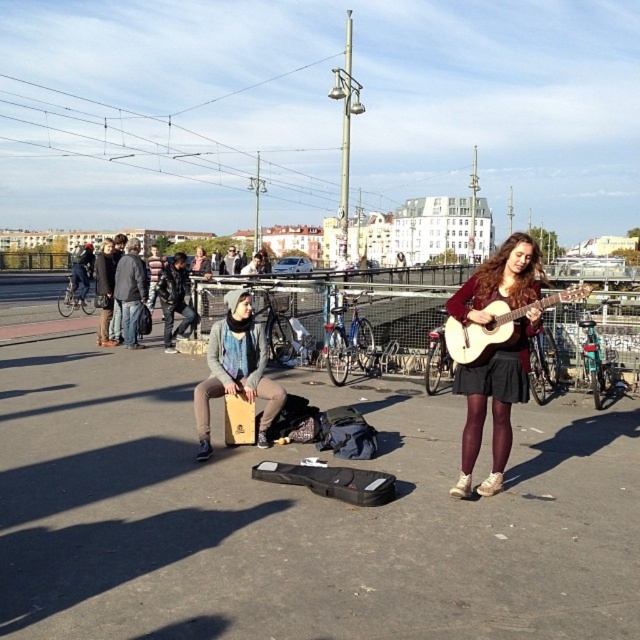
Is point (506, 244) closer to viewer compared to point (544, 298)?

No.

Which is more to the left, matte brown guitar at center or acoustic wood guitar at right?

matte brown guitar at center is more to the left.

Which is behind, point (538, 253) or point (477, 346)?

Point (477, 346)

This screenshot has height=640, width=640. What are the coordinates of `matte brown guitar at center` in the screenshot? It's located at (492, 403).

Is matte brown guitar at center above leather jacket at center?

No, matte brown guitar at center is not above leather jacket at center.

Does matte brown guitar at center lie behind leather jacket at center?

No, matte brown guitar at center is closer to the viewer.

Is point (472, 404) positioned in front of point (234, 262)?

Yes, it is in front of point (234, 262).

Where is `matte brown guitar at center`? matte brown guitar at center is located at coordinates (492, 403).

Is matte brown guitar at center bigger than dark gray hoodie at center?

Incorrect, matte brown guitar at center is not larger than dark gray hoodie at center.

Does point (480, 307) come closer to viewer compared to point (120, 260)?

Yes.

I want to click on matte brown guitar at center, so click(492, 403).